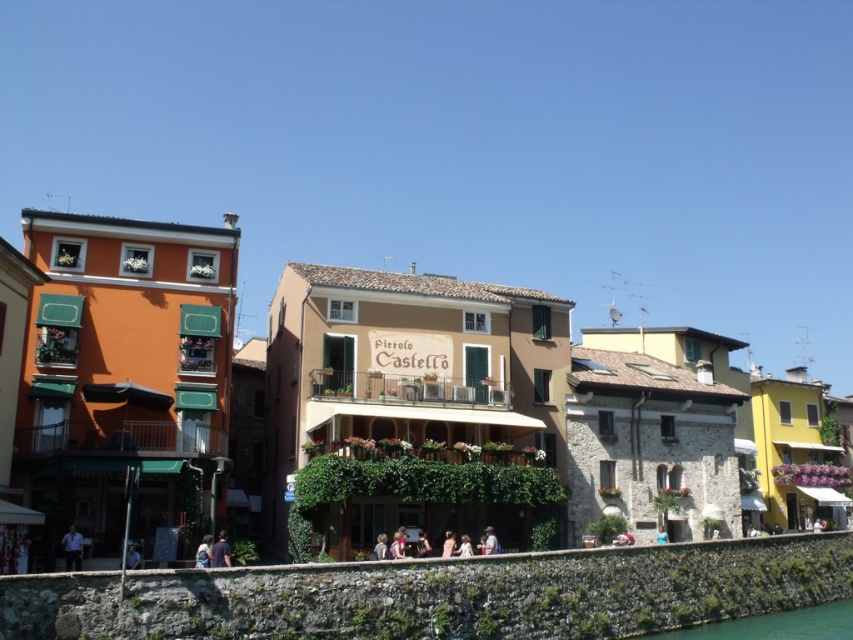
Question: Can you confirm if green liquid water at lower center is thinner than blue fabric person at lower left?

Choices:
 (A) no
 (B) yes

Answer: (A)

Question: Is green liquid water at lower center smaller than dark blue shirt at lower center?

Choices:
 (A) no
 (B) yes

Answer: (A)

Question: Estimate the real-world distances between objects in this image. Which object is closer to the dark blue shirt at lower center?

Choices:
 (A) light brown leather jacket at center
 (B) green liquid water at lower center
 (C) light blue fabric shirt at lower left
 (D) blue fabric person at lower left

Answer: (D)

Question: Which point is farther to the camera?

Choices:
 (A) blue fabric person at lower left
 (B) light blue fabric shirt at lower left

Answer: (B)

Question: Which point appears closest to the camera in this image?

Choices:
 (A) (131, 552)
 (B) (219, 534)

Answer: (A)

Question: Is light blue fabric shirt at lower left positioned in front of blue fabric person at lower left?

Choices:
 (A) yes
 (B) no

Answer: (B)